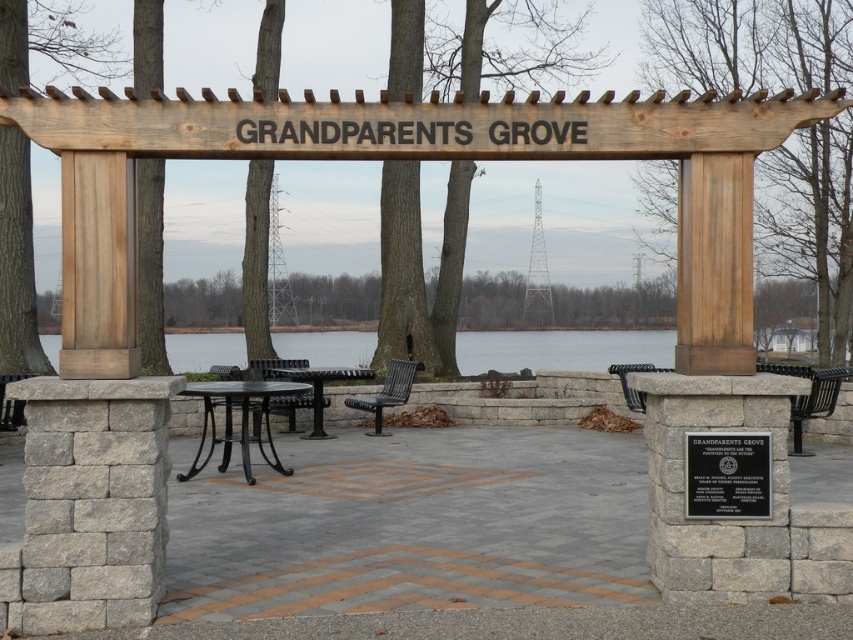
Which is behind, point (711, 35) or point (381, 388)?

Point (711, 35)

Is brown wooden post at right wider than black textured bench at center?

No.

Between point (778, 161) and point (389, 372), which one is positioned behind?

The point (778, 161) is behind.

You are a GUI agent. You are given a task and a screenshot of the screen. Output one action in this format:
    pyautogui.click(x=<x>, y=<y>)
    Task: Click on the brown wooden post at right
    
    Given the screenshot: What is the action you would take?
    coord(747,44)

Can you confirm if brown wooden post at right is positioned below clear water at center?

No.

Measure the distance between brown wooden post at right and camera.

brown wooden post at right and camera are 21.96 meters apart from each other.

Does point (656, 220) come closer to viewer compared to point (207, 342)?

Yes.

I want to click on brown wooden post at right, so click(x=747, y=44).

Does black polished stone plaque at center have a greater height compared to black wrought iron picnic table at center?

In fact, black polished stone plaque at center may be shorter than black wrought iron picnic table at center.

Which is in front, point (694, 444) or point (259, 451)?

Point (694, 444) is in front.

I want to click on black polished stone plaque at center, so click(727, 476).